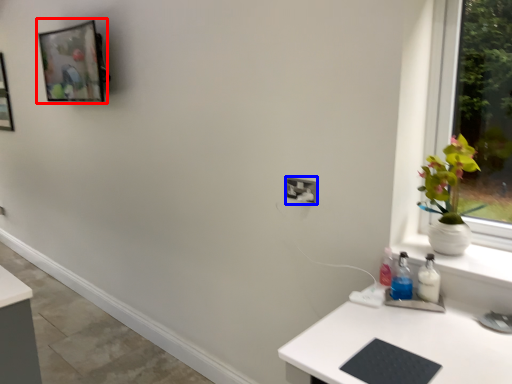
Question: Among these objects, which one is nearest to the camera, picture frame (highlighted by a red box) or electric outlet (highlighted by a blue box)?

Choices:
 (A) picture frame
 (B) electric outlet

Answer: (B)